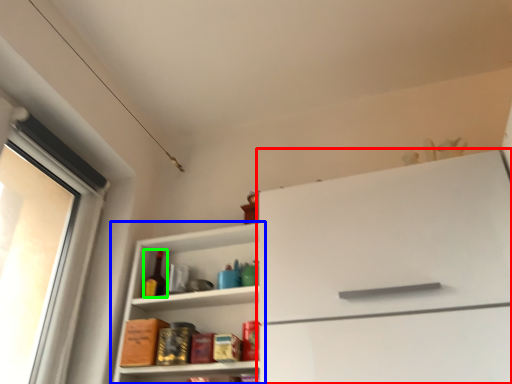
Question: Based on their relative distances, which object is farther from cabinetry (highlighted by a red box)? Choose from shelf (highlighted by a blue box) and bottle (highlighted by a green box).

Choices:
 (A) shelf
 (B) bottle

Answer: (B)